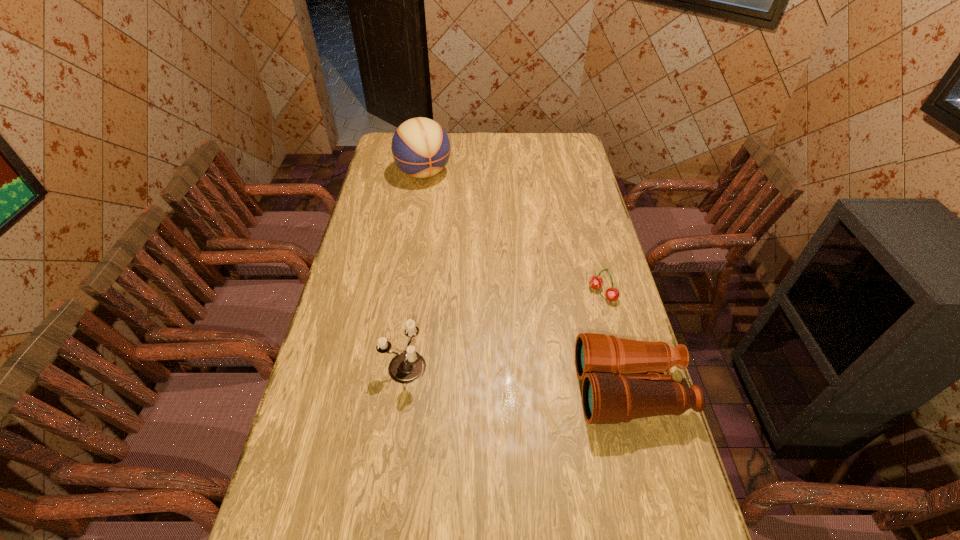
Where is `free space on the desktop that is between the candle holder and the binoculars and is positioned on the patterned surface of the basketball`? The width and height of the screenshot is (960, 540). free space on the desktop that is between the candle holder and the binoculars and is positioned on the patterned surface of the basketball is located at coordinates tap(549, 381).

The height and width of the screenshot is (540, 960). I want to click on free space on the desktop that is between the candle holder and the binoculars and is positioned with stems pointing upwards on the third nearest object, so point(486,375).